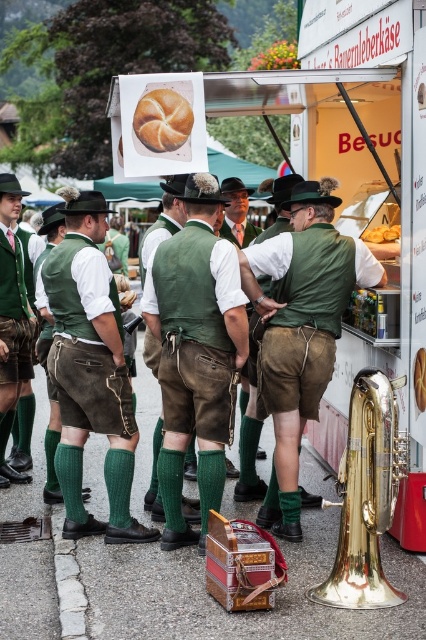
Can you confirm if green fabric vest at center is positioned to the left of gold brass trumpet at lower right?

Correct, you'll find green fabric vest at center to the left of gold brass trumpet at lower right.

Measure the distance between green fabric vest at center and gold brass trumpet at lower right.

The distance of green fabric vest at center from gold brass trumpet at lower right is 37.93 inches.

This screenshot has height=640, width=426. Identify the location of green fabric vest at center. (301, 326).

Which is more to the right, matte white food truck at center or brown matte bagel at center?

From the viewer's perspective, matte white food truck at center appears more on the right side.

In the scene shown: Can you confirm if matte white food truck at center is bigger than brown matte bagel at center?

Yes.

Is point (301, 152) positioned after point (192, 118)?

Yes, it is behind point (192, 118).

Image resolution: width=426 pixels, height=640 pixels. I want to click on matte white food truck at center, so click(357, 170).

Between point (365, 118) and point (204, 499), which one is positioned behind?

Point (365, 118)

Consider the image. Who is higher up, matte white food truck at center or green wool vest at center?

Positioned higher is matte white food truck at center.

The width and height of the screenshot is (426, 640). Identify the location of matte white food truck at center. (357, 170).